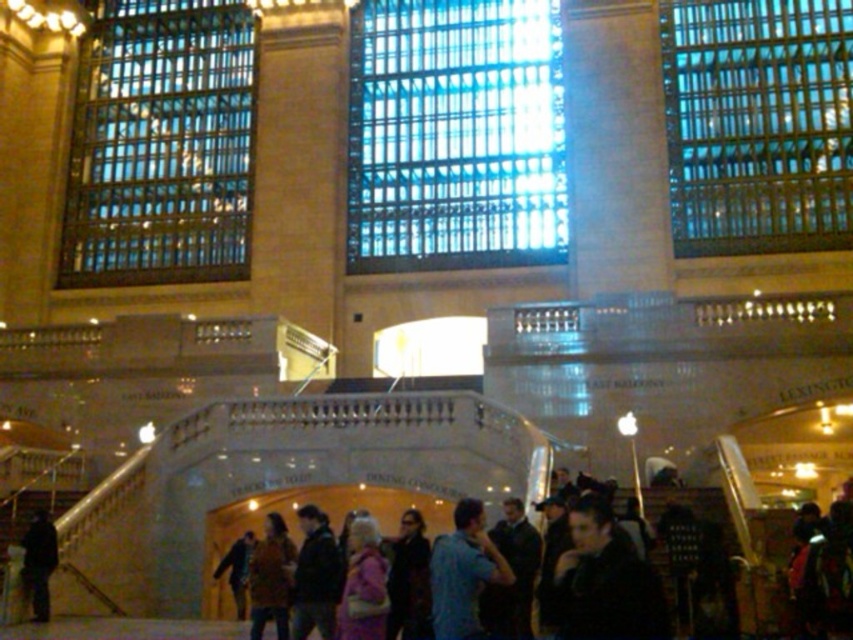
You are standing at the base of the curved staircase with white balustrades in the grand historic building. You see a pink fabric jacket at center. Based on its coordinates, where exactly is the pink fabric jacket located relative to the staircase?

The pink fabric jacket at center is located at coordinates point (363, 584), which places it near the top of the curved staircase with white balustrades.

You are an observer standing at the base of the curved staircase with white balustrades. You notice two items at the center of the scene. Which item is smaller in size between the pink fabric jacket at center and the dark sunglasses at center?

The pink fabric jacket at center is smaller in size compared to the dark sunglasses at center.

You are standing at the bottom of the curved staircase with white balustrades in the historic building. You notice two people wearing jackets at the lower left. Which of the two jackets, the dark matte jacket at lower left or the dark blue jacket at lower left, is narrower?

The dark matte jacket at lower left is narrower than the dark blue jacket at lower left.